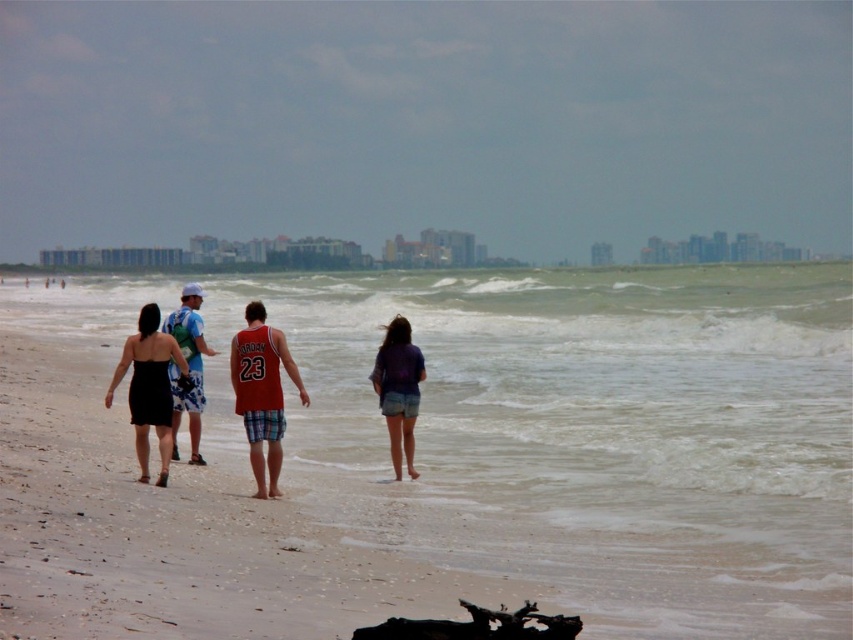
You are standing on the beach looking out to sea. You see the greenish water at center and the white cap at center. Which one is closer to the shore?

The white cap at center is closer to the shore because it is to the left of the greenish water at center, and since waves move towards the shore, the white cap would be nearer.

Based on the photo, you are standing at the shoreline on the beach and see the black wood at lower center. Based on its position, can you determine if it is closer to the water or the sand?

The black wood at lower center is located at point coordinates that place it closer to the water since its y coordinate is 0.560, which is lower on the image plane, meaning it is nearer to the water edge.

You are a lifeguard on duty at the beach. You notice two areas in the water at center where swimmers might be. The greenish water at center and the white cap at center. Based on their widths, which area would you advise swimmers to avoid for safety?

The greenish water at center is wider than the white cap at center. Since wider areas might have stronger currents, it would be safer to avoid the greenish water at center.